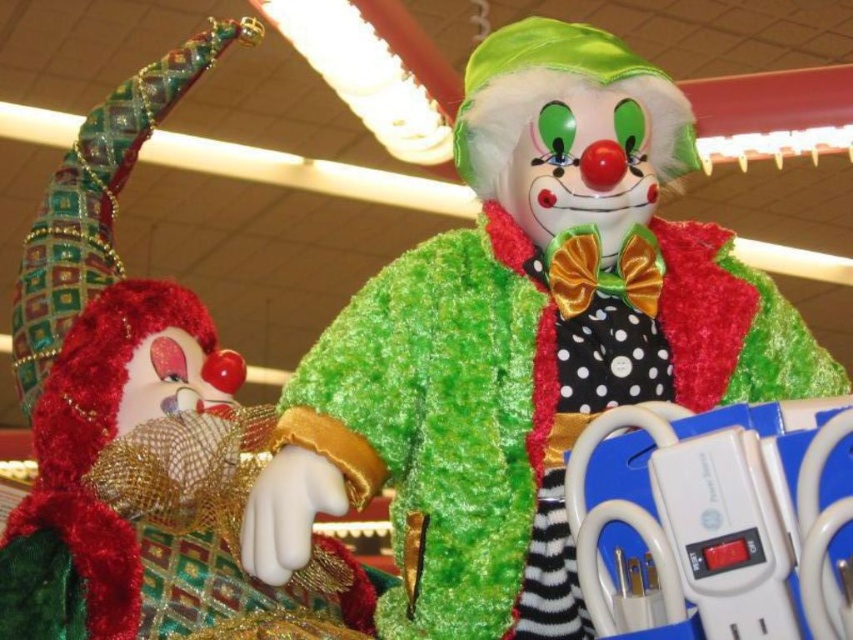
Question: Observing the image, what is the correct spatial positioning of fuzzy green clown at center in reference to velvet red clown at left?

Choices:
 (A) below
 (B) above

Answer: (A)

Question: Among these points, which one is farthest from the camera?

Choices:
 (A) 172,70
 (B) 590,330

Answer: (A)

Question: Does fuzzy green clown at center appear on the right side of velvet red clown at left?

Choices:
 (A) yes
 (B) no

Answer: (A)

Question: Is fuzzy green clown at center thinner than velvet red clown at left?

Choices:
 (A) yes
 (B) no

Answer: (B)

Question: Which point is farther from the camera taking this photo?

Choices:
 (A) (227, 33)
 (B) (312, 500)

Answer: (A)